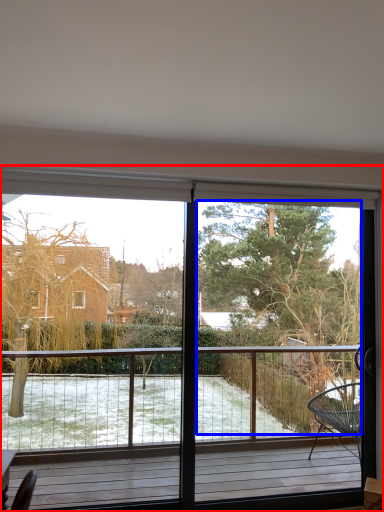
Question: Among these objects, which one is farthest to the camera, window (highlighted by a red box) or tree (highlighted by a blue box)?

Choices:
 (A) window
 (B) tree

Answer: (B)